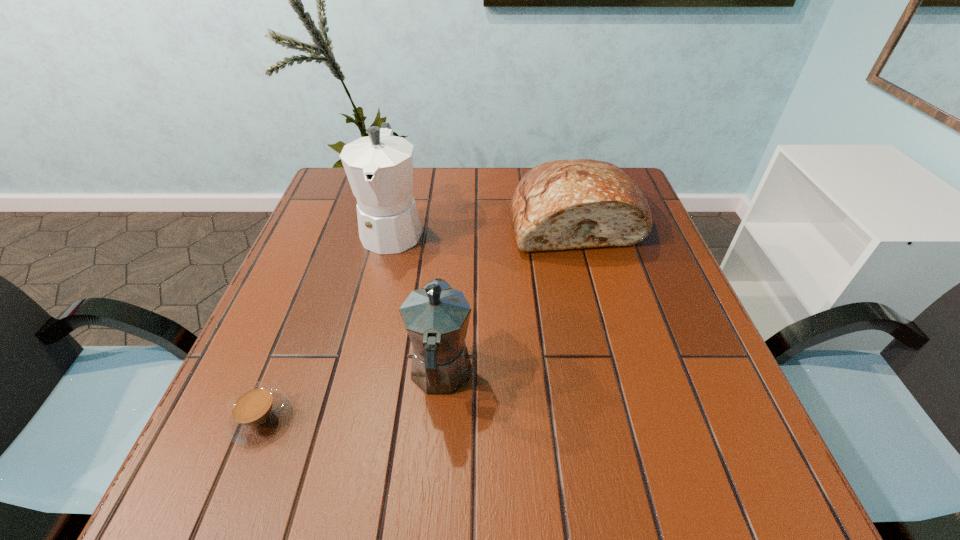
The height and width of the screenshot is (540, 960). I want to click on object at the far right corner, so click(577, 203).

In the image, there is a desktop. Where is `free space at the far edge`? free space at the far edge is located at coordinates (456, 209).

This screenshot has height=540, width=960. In order to click on vacant space at the near edge in this screenshot , I will do `click(474, 454)`.

This screenshot has width=960, height=540. In the image, there is a desktop. In order to click on vacant space at the left edge in this screenshot , I will do `click(348, 231)`.

Locate an element on the screen. The image size is (960, 540). blank space at the right edge is located at coordinates (684, 365).

Find the location of a particular element. Image resolution: width=960 pixels, height=540 pixels. vacant space at the near right corner of the desktop is located at coordinates pyautogui.click(x=683, y=477).

Where is `vacant area that lies between the second object from left to right and the rightmost object`? vacant area that lies between the second object from left to right and the rightmost object is located at coordinates (484, 224).

Image resolution: width=960 pixels, height=540 pixels. I want to click on empty location between the second object from right to left and the leftmost object, so click(x=350, y=397).

Image resolution: width=960 pixels, height=540 pixels. In order to click on free area in between the left coffeepot and the shortest object in this screenshot , I will do `click(326, 324)`.

I want to click on vacant area that lies between the third shortest object and the leftmost object, so click(x=350, y=397).